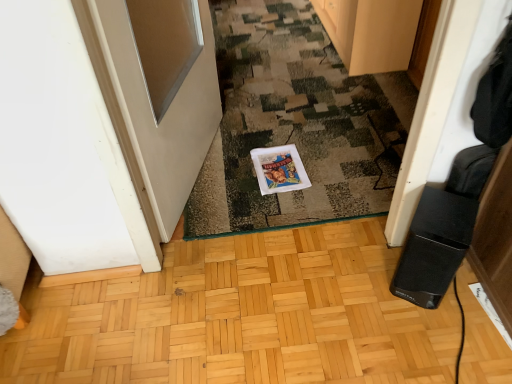
This screenshot has width=512, height=384. I want to click on free space below white glossy door at left (from a real-world perspective), so click(x=197, y=178).